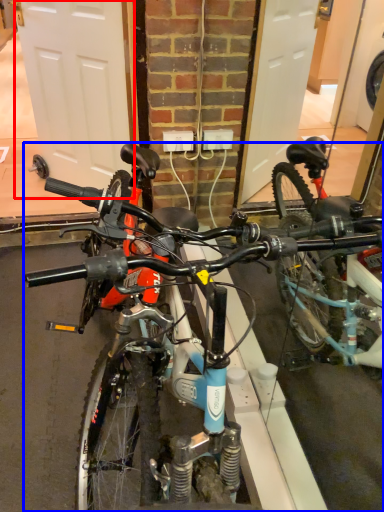
Question: Which of the following is the farthest to the observer, garage door (highlighted by a red box) or bicycle (highlighted by a blue box)?

Choices:
 (A) garage door
 (B) bicycle

Answer: (A)